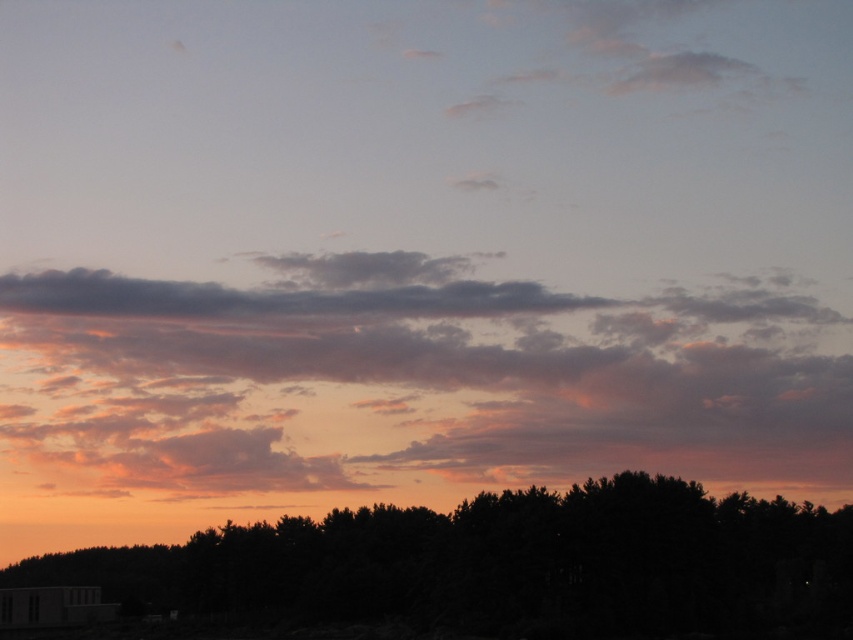
You are standing in the middle of the forest looking towards the sunset. You see the cloudy sky at upper center and the silhouette tree at lower center. Which object is closer to you?

The cloudy sky at upper center is closer to you because it is further to the viewer than the silhouette tree at lower center.

From the picture: You are a drone operator planning to fly a drone between the cloudy sky at upper center and the silhouette tree at lower center. The drone has a maximum flight distance of 100 meters. Can the drone safely travel between these two points without exceeding its range?

The distance between the cloudy sky at upper center and the silhouette tree at lower center is 92.94 meters, which is within the drone operator maximum flight distance of 100 meters. Therefore, the drone can safely travel between these two points without exceeding its range.

Consider the image. You are an artist trying to paint the sunset scene. You want to ensure the cloudy sky at upper center and the silhouette tree at lower center are proportionally accurate. Which object should you paint wider?

The cloudy sky at upper center should be painted wider since its width is larger than the silhouette tree at lower center.